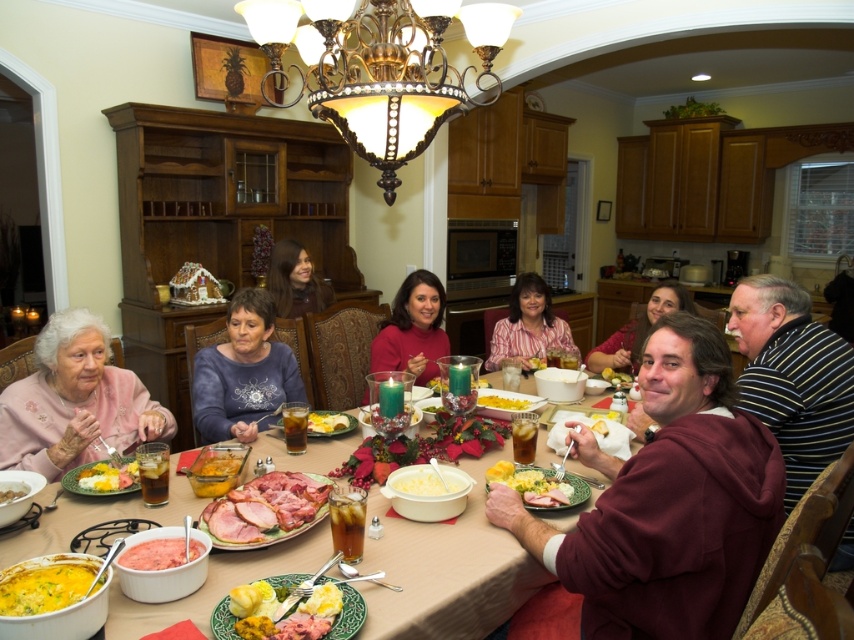
Question: Based on their relative distances, which object is nearer to the pink glossy ham at center?

Choices:
 (A) yellow mashed potato at center
 (B) matte pink sweater at lower left
 (C) striped shirt at center
 (D) smooth brown hair at center

Answer: (B)

Question: Does matte blue shirt at center have a smaller size compared to maroon fleece jacket at lower right?

Choices:
 (A) yes
 (B) no

Answer: (B)

Question: Does yellow mashed potatoes at center lie in front of translucent glass candle at center?

Choices:
 (A) yes
 (B) no

Answer: (A)

Question: Which of these objects is positioned farthest from the translucent glass candle at center?

Choices:
 (A) yellow mashed potatoes at center
 (B) matte blue shirt at center
 (C) yellow creamy mashed potatoes at center
 (D) white creamy mashed potatoes at center

Answer: (A)

Question: Based on their relative distances, which object is farther from the maroon fleece at center?

Choices:
 (A) yellow mashed potato at center
 (B) gold metallic chandelier at upper center

Answer: (A)

Question: Does striped shirt at center appear on the right side of pink glossy ham at center?

Choices:
 (A) no
 (B) yes

Answer: (B)